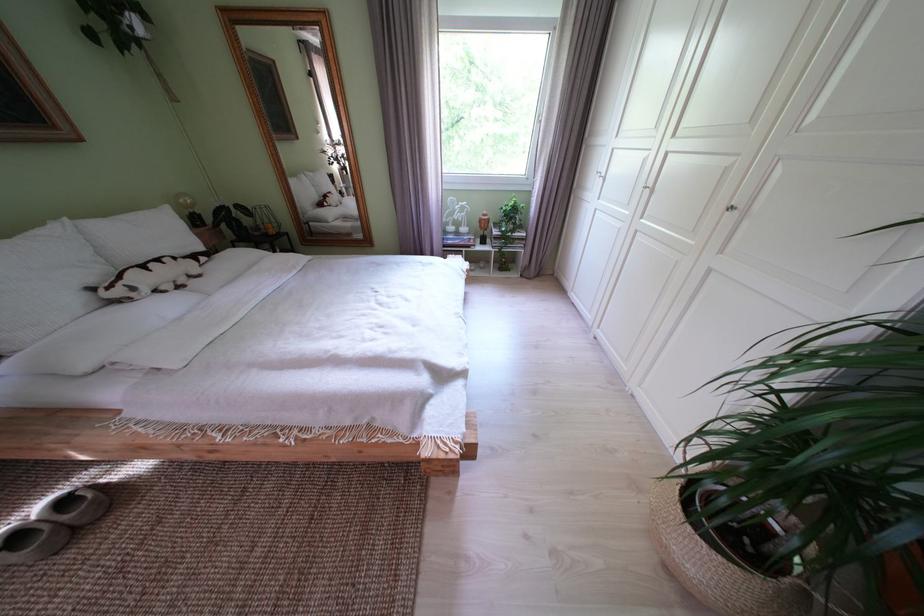
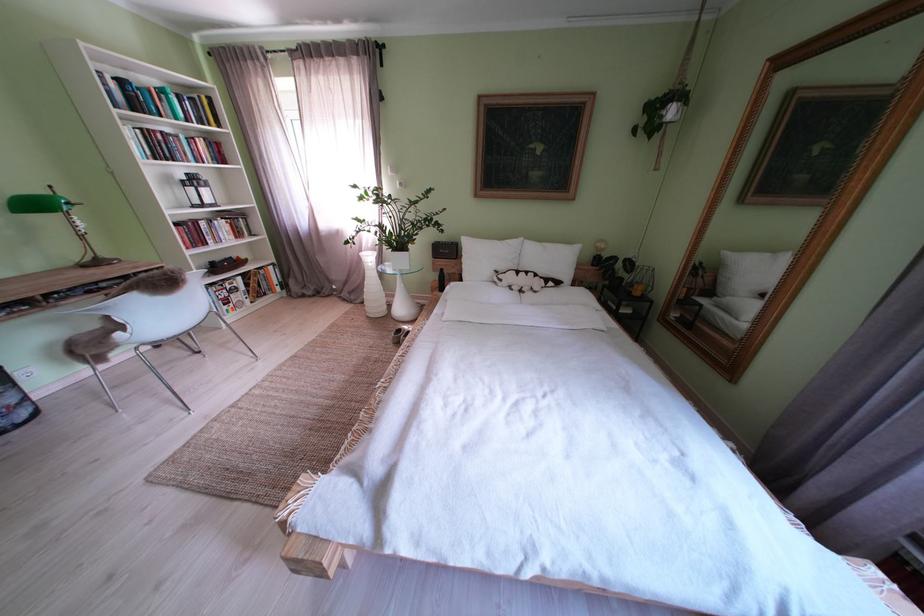
Locate, in the second image, the point that corresponds to [146,294] in the first image.

(512, 285)